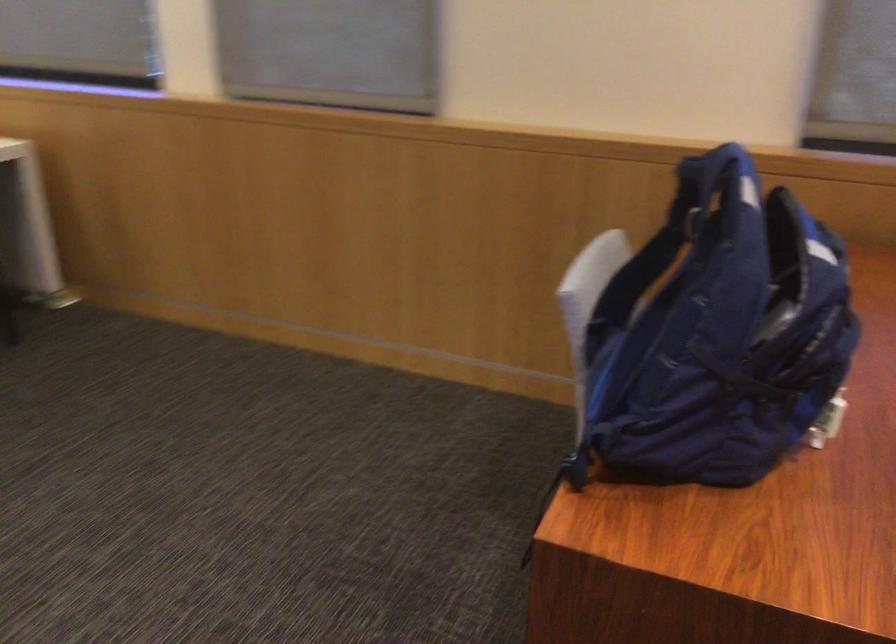
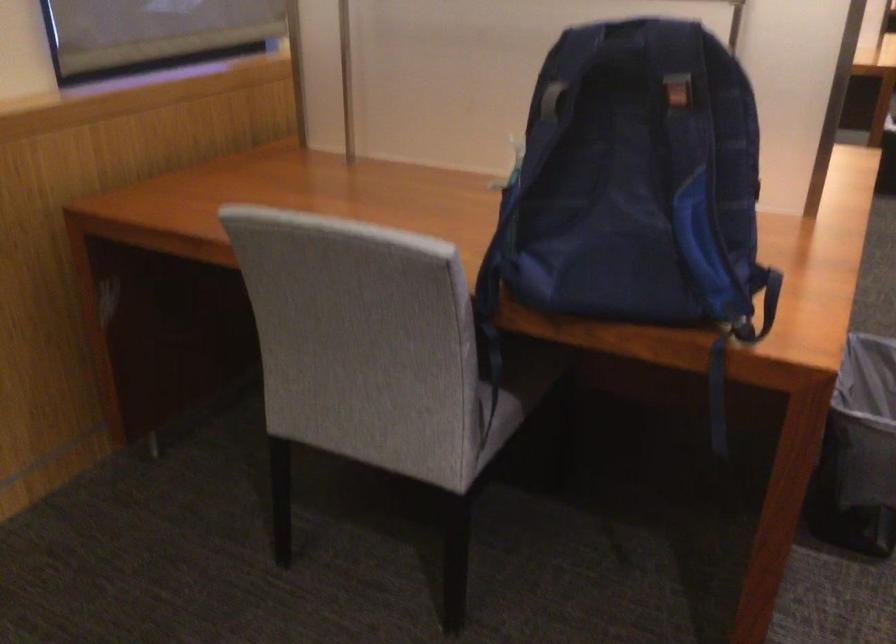
Locate, in the second image, the point that corresponds to point (694, 238) in the first image.

(677, 93)